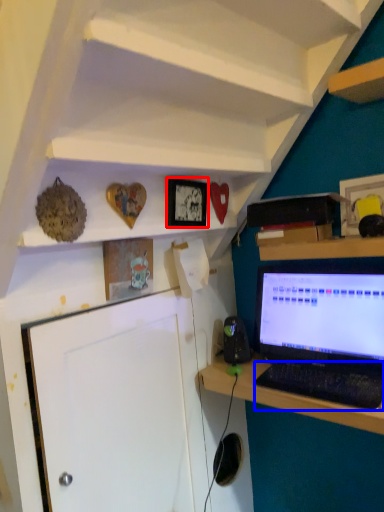
Question: Which object appears farthest to the camera in this image, picture frame (highlighted by a red box) or computer keyboard (highlighted by a blue box)?

Choices:
 (A) picture frame
 (B) computer keyboard

Answer: (A)